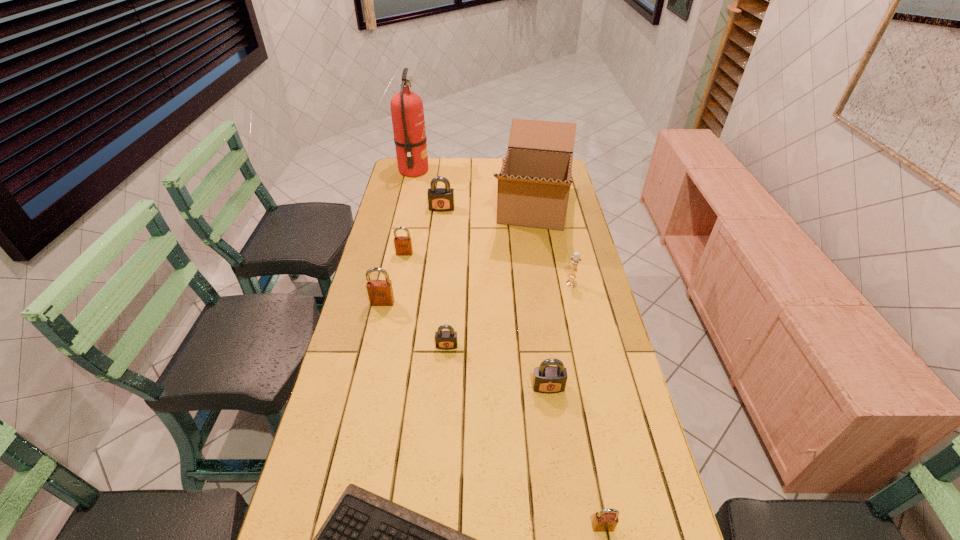
What are the coordinates of `brown padlock object that ranks as the closest to the sixth nearest object` in the screenshot? It's located at (403, 245).

Locate an element on the screen. This screenshot has width=960, height=540. brown padlock that stands as the second closest to the nearest padlock is located at coordinates (403, 245).

The image size is (960, 540). In order to click on vacant space that satisfies the following two spatial constraints: 1. on the front of the biggest gray padlock near the keyhole; 2. on the left side of the sixth nearest object in this screenshot , I will do `click(433, 284)`.